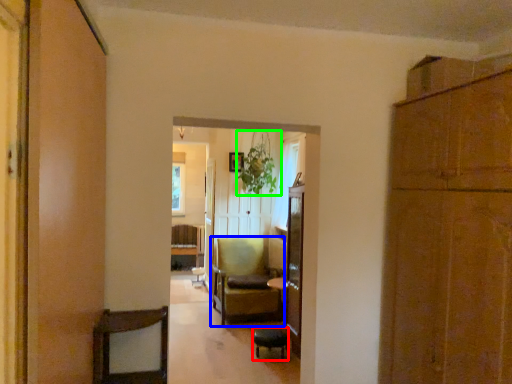
Question: Which is farther away from bar stool (highlighted by a red box)? chair (highlighted by a blue box) or plant (highlighted by a green box)?

Choices:
 (A) chair
 (B) plant

Answer: (B)